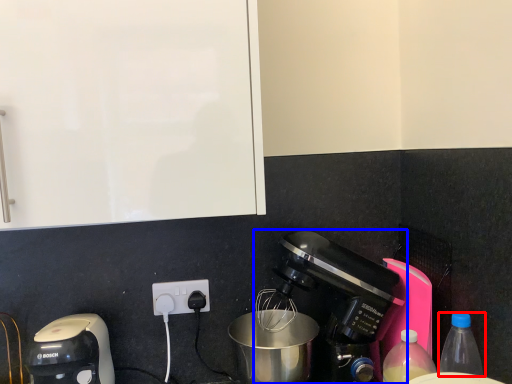
Question: Which object appears farthest to the camera in this image, bottle (highlighted by a red box) or coffee maker (highlighted by a blue box)?

Choices:
 (A) bottle
 (B) coffee maker

Answer: (B)